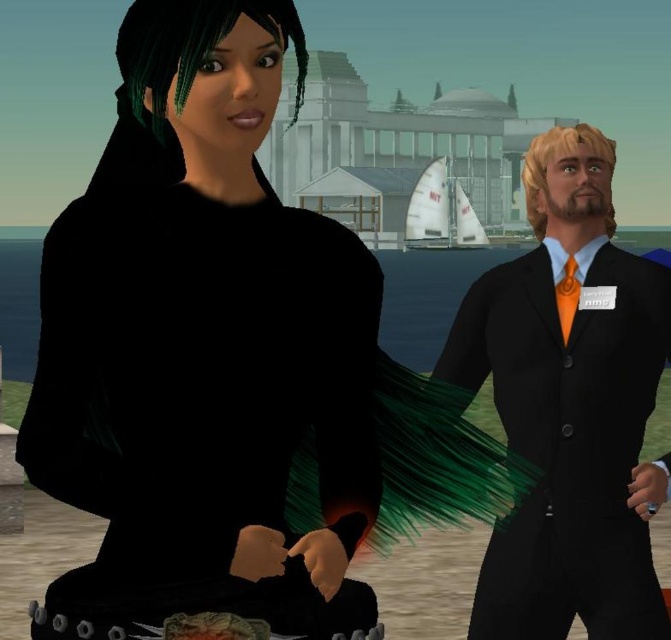
You are a character in the scene and need to quickly move to the right to avoid an incoming hazard. Which object will you pass by first, the matte black dress at left or the matte black suit at right?

The matte black dress at left will be passed by first because it is positioned in front of the matte black suit at right, making it closer to your current position.

You are a fashion designer observing two individuals in a digital environment. The first person is wearing a matte black dress at left, and the second is wearing a matte black suit at right. Based on their positions, which clothing item appears closer to you?

The matte black dress at left appears closer because it is positioned above the matte black suit at right, indicating it is in a higher plane and thus nearer to the viewer.

You are a photographer trying to capture a perfect shot of the two characters in the scene. The camera is set to focus on objects exactly 1.64 meters away. Will the point at coordinates point (136, 387) be in focus?

The point at coordinates point (136, 387) is exactly 1.64 meters from the camera, so it will be in focus.